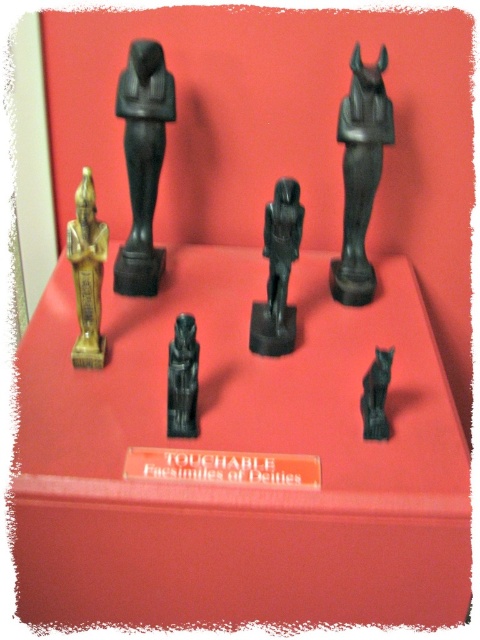
Question: Which object is closer to the camera taking this photo?

Choices:
 (A) matte black statue at center
 (B) black polished statue at center

Answer: (A)

Question: Does black stone statue at upper center appear on the left side of black polished statue at center?

Choices:
 (A) yes
 (B) no

Answer: (B)

Question: Estimate the real-world distances between objects in this image. Which object is closer to the matte black statue at center?

Choices:
 (A) black stone statue at center
 (B) black stone cat at lower right

Answer: (A)

Question: Is the position of matte black statue at center less distant than that of black stone cat at lower right?

Choices:
 (A) yes
 (B) no

Answer: (A)

Question: Which of the following is the farthest from the observer?

Choices:
 (A) (108, 584)
 (B) (199, 348)

Answer: (B)

Question: Does matte black statue at center come behind black stone statue at upper center?

Choices:
 (A) no
 (B) yes

Answer: (A)